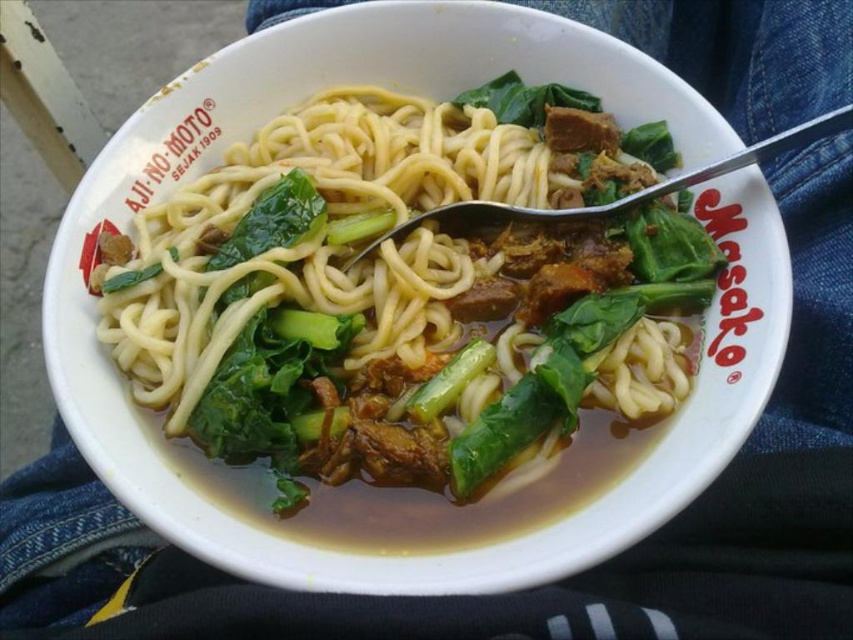
Question: Which point is closer to the camera taking this photo?

Choices:
 (A) (408, 449)
 (B) (527, 86)

Answer: (A)

Question: Is yellow matte noodles at center to the right of green leafy vegetable at center from the viewer's perspective?

Choices:
 (A) yes
 (B) no

Answer: (B)

Question: Does yellow matte noodles at center appear on the right side of green leafy vegetable at center?

Choices:
 (A) no
 (B) yes

Answer: (A)

Question: Which of the following is the closest to the observer?

Choices:
 (A) yellow matte noodles at center
 (B) green leafy vegetable at center

Answer: (A)

Question: Is yellow matte noodles at center above green leafy vegetable at center?

Choices:
 (A) yes
 (B) no

Answer: (B)